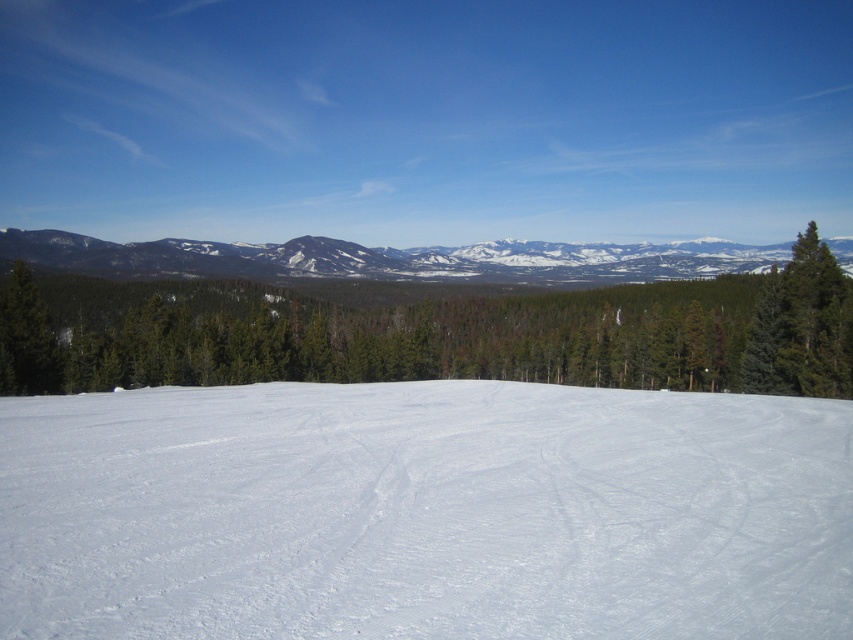
Is the position of white smooth snow at center less distant than that of green matte tree at center?

That is True.

Can you confirm if white smooth snow at center is wider than green matte tree at center?

In fact, white smooth snow at center might be narrower than green matte tree at center.

Locate an element on the screen. This screenshot has width=853, height=640. white smooth snow at center is located at coordinates (424, 513).

You are a GUI agent. You are given a task and a screenshot of the screen. Output one action in this format:
    pyautogui.click(x=<x>, y=<y>)
    Task: Click on the white smooth snow at center
    This screenshot has height=640, width=853.
    Given the screenshot: What is the action you would take?
    coord(424,513)

Does green matte tree at center have a lesser height compared to snowy rocky mountain at upper center?

No, green matte tree at center is not shorter than snowy rocky mountain at upper center.

Describe the element at coordinates (413, 316) in the screenshot. The height and width of the screenshot is (640, 853). I see `green matte tree at center` at that location.

Who is more distant from viewer, (392, 328) or (602, 250)?

Positioned behind is point (602, 250).

Where is `green matte tree at center`? green matte tree at center is located at coordinates (413, 316).

Is point (532, 609) less distant than point (86, 250)?

Yes.

Is point (836, 429) positioned behind point (730, 257)?

That is False.

What do you see at coordinates (424, 513) in the screenshot? This screenshot has width=853, height=640. I see `white smooth snow at center` at bounding box center [424, 513].

This screenshot has height=640, width=853. I want to click on white smooth snow at center, so click(424, 513).